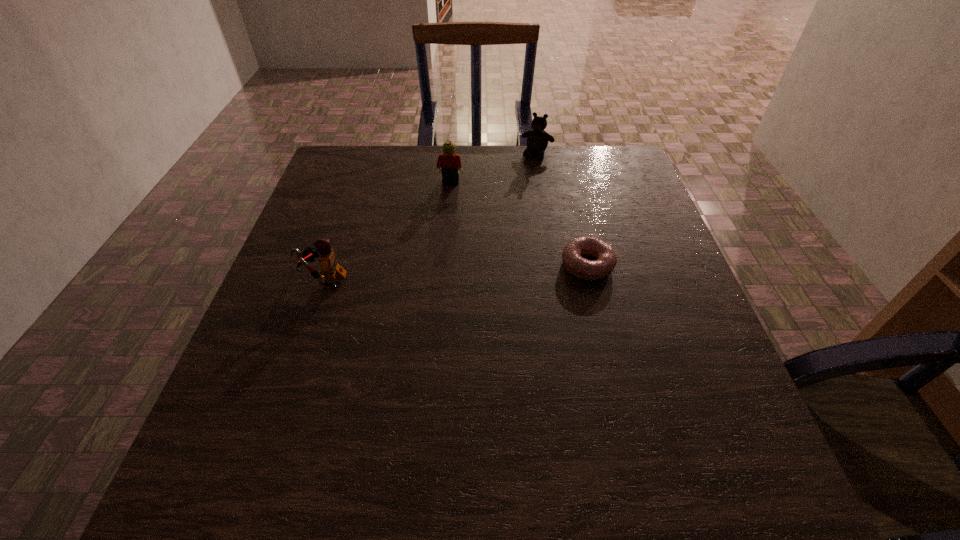
Identify the location of the left Lego. (330, 268).

The width and height of the screenshot is (960, 540). I want to click on the nearer Lego, so click(330, 268).

In order to click on doughnut in this screenshot , I will do `click(573, 262)`.

What are the coordinates of `the second object from left to right` in the screenshot? It's located at (450, 163).

This screenshot has height=540, width=960. Identify the location of the right Lego. (450, 163).

Locate an element on the screen. the farthest object is located at coordinates (537, 139).

Find the location of `free region located on the back of the shortest object`. free region located on the back of the shortest object is located at coordinates (571, 197).

In order to click on free region located 0.200m on the face of the farther Lego in this screenshot , I will do `click(437, 235)`.

The width and height of the screenshot is (960, 540). I want to click on free space located on the face of the farther Lego, so click(x=427, y=276).

Locate an element on the screen. free location located 0.260m on the face of the farther Lego is located at coordinates (433, 252).